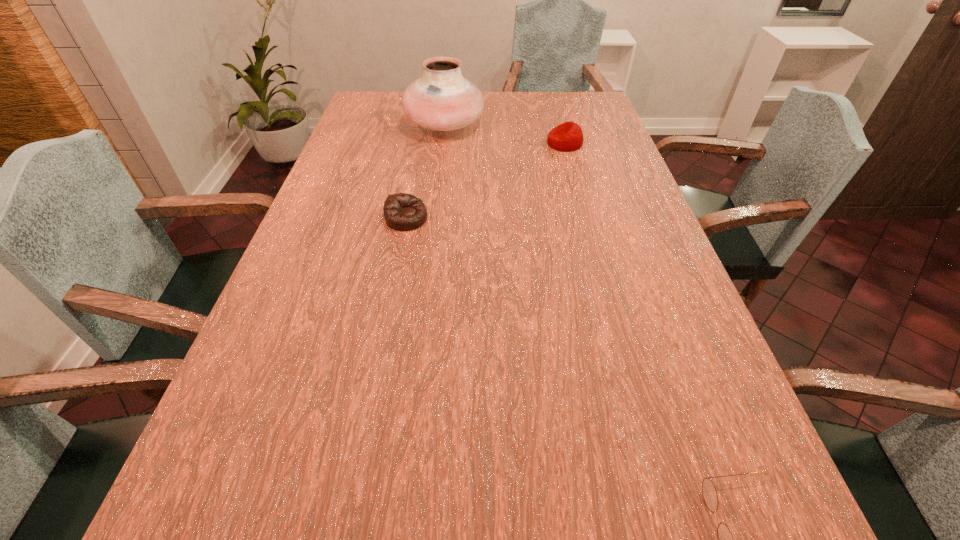
The height and width of the screenshot is (540, 960). Find the location of `pottery`. pottery is located at coordinates (442, 99).

Locate an element on the screen. The image size is (960, 540). the farther beanbag is located at coordinates (568, 136).

Find the location of `the taller beanbag`. the taller beanbag is located at coordinates (568, 136).

Where is `the nearer beanbag`? the nearer beanbag is located at coordinates (402, 212).

Identify the location of the second nearest object. The width and height of the screenshot is (960, 540). (402, 212).

Find the location of a particular element. This screenshot has height=540, width=960. free space located 0.260m on the right of the tallest object is located at coordinates (561, 125).

Image resolution: width=960 pixels, height=540 pixels. What are the coordinates of `free location located 0.360m on the seat area of the right beanbag` in the screenshot? It's located at (434, 144).

Where is `free region located on the seat area of the right beanbag`? The width and height of the screenshot is (960, 540). free region located on the seat area of the right beanbag is located at coordinates (438, 144).

Locate an element on the screen. Image resolution: width=960 pixels, height=540 pixels. vacant area situated on the seat area of the right beanbag is located at coordinates (431, 144).

The width and height of the screenshot is (960, 540). In order to click on free region located on the front of the second nearest object in this screenshot , I will do point(390,304).